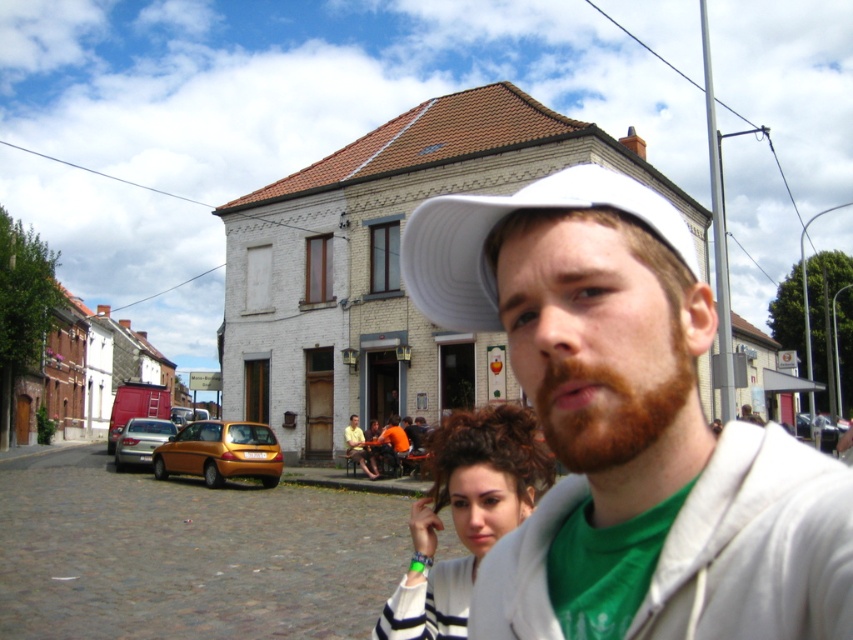
Is orange shirt at center further to the viewer compared to matte silver sedan at left?

No, it is in front of matte silver sedan at left.

Which is more to the right, orange shirt at center or matte silver sedan at left?

Positioned to the right is orange shirt at center.

Image resolution: width=853 pixels, height=640 pixels. Describe the element at coordinates (378, 445) in the screenshot. I see `orange shirt at center` at that location.

Find the location of a particular element. The image size is (853, 640). orange shirt at center is located at coordinates (378, 445).

Can you confirm if white matte baseball cap at center is positioned below orange shirt at center?

No.

Looking at this image, is white matte baseball cap at center above orange shirt at center?

Yes.

At what (x,y) coordinates should I click in order to perform the action: click on white matte baseball cap at center. Please return your answer as a coordinate pair (x, y). This screenshot has height=640, width=853. Looking at the image, I should click on (500, 224).

Between white matte cap at center and orange shirt at center, which one is positioned lower?

orange shirt at center is below.

Can you confirm if white matte cap at center is wider than orange shirt at center?

Incorrect, white matte cap at center's width does not surpass orange shirt at center's.

Is point (521, 259) in front of point (407, 452)?

Yes, point (521, 259) is in front of point (407, 452).

Find the location of a particular element. white matte cap at center is located at coordinates (628, 428).